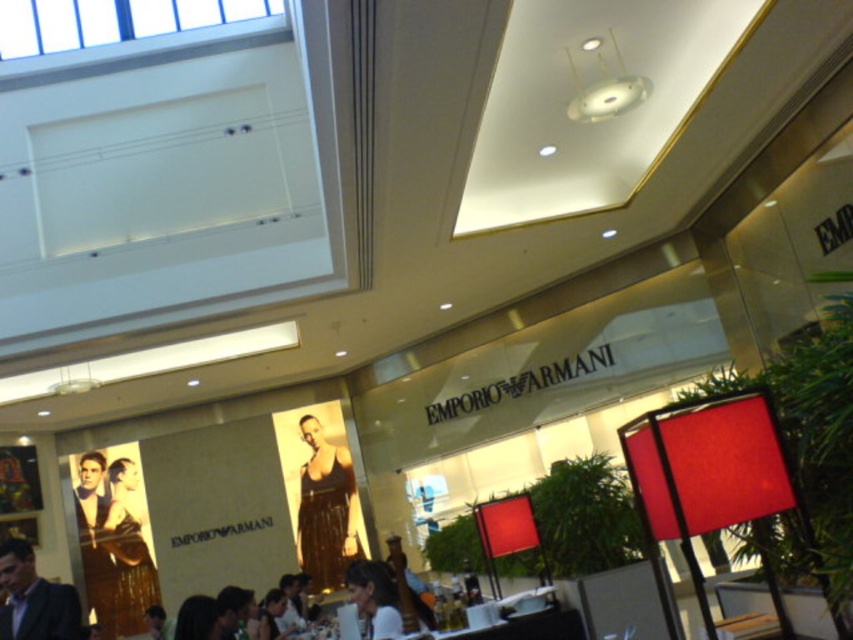
You are a photographer positioned in front of the Emporio Armani store. You want to take a photo of the shiny gold dress at center and the dark suit at lower left. Which object is closer to you?

The dark suit at lower left is behind the shiny gold dress at center, so the shiny gold dress at center is closer to you.

You are a photographer standing in the Emporio Armani store. You need to take a photo of both the dark suit at lower left and the matte black shirt at center. However, you can only focus on one object at a time. Which object should you focus on first to ensure the other is still in the background?

You should focus on the dark suit at lower left first because it is positioned over the matte black shirt at center, meaning the matte black shirt at center is behind it. By focusing on the closer object, the background object will still be in view.